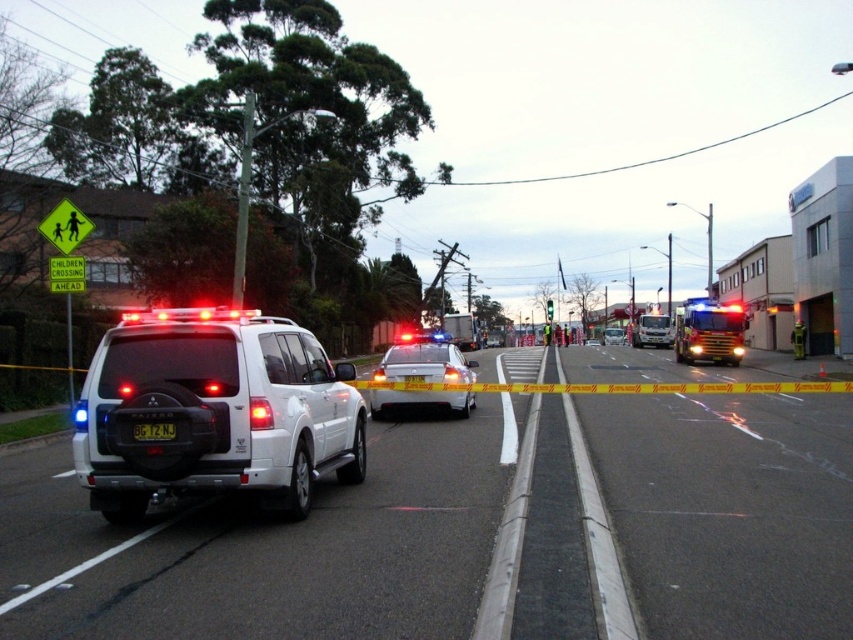
Question: Among these points, which one is farthest from the camera?

Choices:
 (A) (587, 342)
 (B) (392, 400)

Answer: (A)

Question: Is shiny silver sedan at center below shiny red fire truck at center?

Choices:
 (A) yes
 (B) no

Answer: (A)

Question: Based on their relative distances, which object is nearer to the white glossy sedan at center?

Choices:
 (A) black plastic license plate at center
 (B) white matte suv at left
 (C) white matte police car at center

Answer: (C)

Question: Can you confirm if shiny red fire truck at center is positioned above white glossy sedan at center?

Choices:
 (A) no
 (B) yes

Answer: (B)

Question: In this image, where is white matte suv at left located relative to white glossy sedan at center?

Choices:
 (A) below
 (B) above

Answer: (A)

Question: Which object is closer to the camera taking this photo?

Choices:
 (A) shiny silver sedan at center
 (B) black plastic license plate at center
 (C) white matte suv at left

Answer: (C)